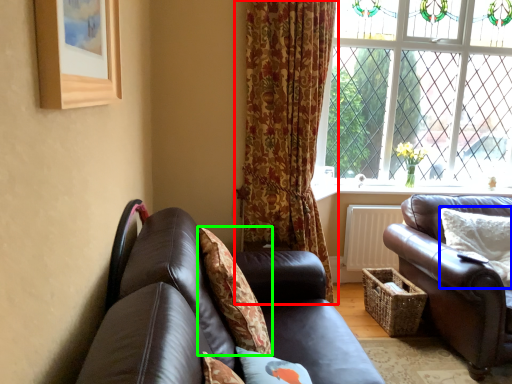
Question: Which object is the closest to the curtain (highlighted by a red box)? Choose among these: pillow (highlighted by a blue box) or pillow (highlighted by a green box).

Choices:
 (A) pillow
 (B) pillow

Answer: (B)